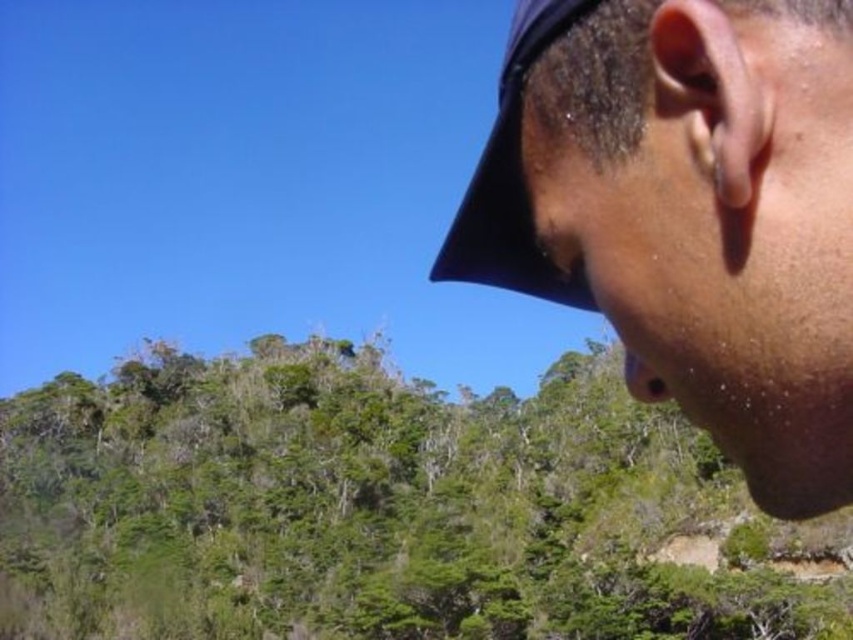
Question: Can you confirm if green leafy trees at center is bigger than black fabric baseball hat at upper right?

Choices:
 (A) no
 (B) yes

Answer: (B)

Question: Which point is farther from the camera taking this photo?

Choices:
 (A) (495, 248)
 (B) (567, 584)
 (C) (805, 20)

Answer: (B)

Question: Does green leafy trees at center appear on the right side of black fabric baseball hat at upper right?

Choices:
 (A) yes
 (B) no

Answer: (B)

Question: Is the position of green leafy trees at center less distant than that of matte black cap at upper right?

Choices:
 (A) no
 (B) yes

Answer: (A)

Question: Among these objects, which one is nearest to the camera?

Choices:
 (A) matte black cap at upper right
 (B) black fabric baseball hat at upper right
 (C) green leafy trees at center

Answer: (A)

Question: Which object is farther from the camera taking this photo?

Choices:
 (A) black fabric baseball hat at upper right
 (B) green leafy trees at center
 (C) matte black cap at upper right

Answer: (B)